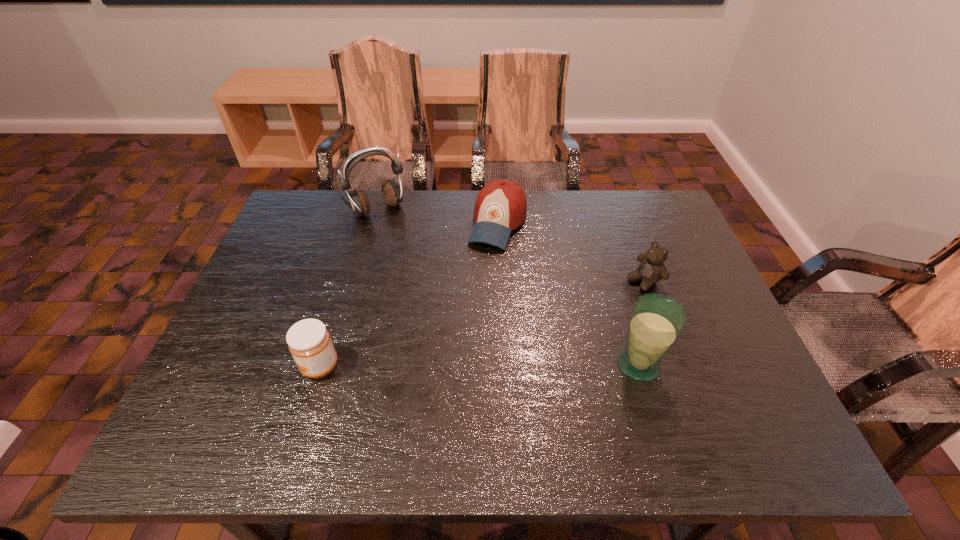
Find the location of a particular element. jam is located at coordinates (309, 342).

This screenshot has width=960, height=540. What are the coordinates of `glass` in the screenshot? It's located at (656, 321).

Locate an element on the screen. The height and width of the screenshot is (540, 960). the third nearest object is located at coordinates (652, 269).

Locate an element on the screen. This screenshot has height=540, width=960. baseball cap is located at coordinates (501, 206).

This screenshot has width=960, height=540. What are the coordinates of `earphone` in the screenshot? It's located at (392, 193).

The image size is (960, 540). I want to click on vacant area situated on the front label of the jam, so click(279, 366).

The image size is (960, 540). I want to click on free space located 0.170m on the front label of the jam, so click(x=226, y=366).

Locate an element on the screen. The height and width of the screenshot is (540, 960). free region located on the front label of the jam is located at coordinates (x=239, y=366).

Find the location of a particular element. Image resolution: width=960 pixels, height=540 pixels. vacant space located 0.140m on the right of the glass is located at coordinates (724, 364).

Where is `vacant space located on the face of the teddy bear`? The height and width of the screenshot is (540, 960). vacant space located on the face of the teddy bear is located at coordinates (580, 319).